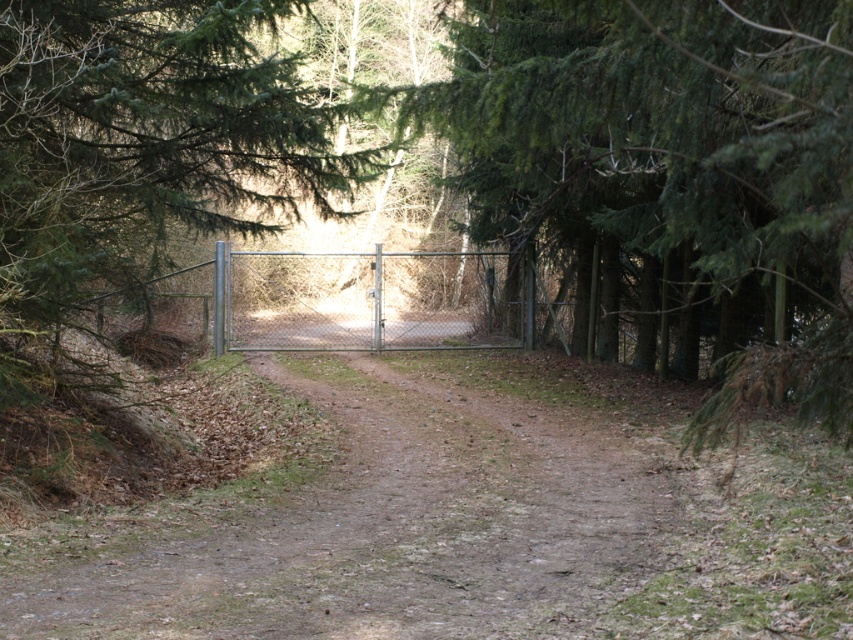
Question: Which point is closer to the camera?

Choices:
 (A) (541, 54)
 (B) (418, 541)
 (C) (480, 253)

Answer: (B)

Question: Where is dirt path at center located in relation to metallic chain-link fence at center in the image?

Choices:
 (A) below
 (B) above

Answer: (A)

Question: Is dirt path at center below green textured tree at center?

Choices:
 (A) no
 (B) yes

Answer: (B)

Question: Can you confirm if dirt path at center is positioned above metallic chain-link fence at center?

Choices:
 (A) yes
 (B) no

Answer: (B)

Question: Which object appears closest to the camera in this image?

Choices:
 (A) green textured tree at center
 (B) metallic chain-link fence at center

Answer: (A)

Question: Which point is closer to the camera?

Choices:
 (A) (440, 412)
 (B) (822, 104)

Answer: (B)